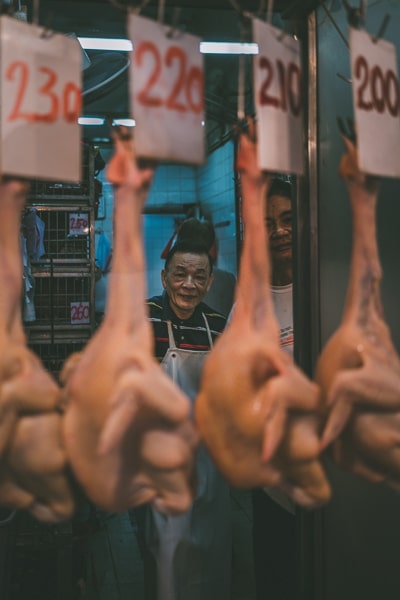
You are a GUI agent. You are given a task and a screenshot of the screen. Output one action in this format:
    pyautogui.click(x=<x>, y=<y>)
    Task: Click on the tile wall
    
    Given the screenshot: What is the action you would take?
    pyautogui.click(x=219, y=179)